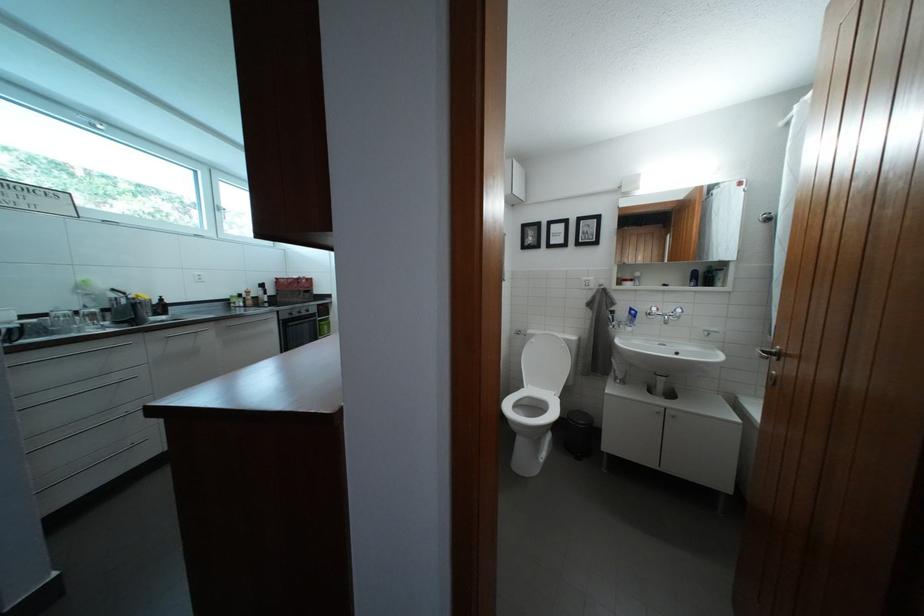
Where would you pull the brown door handle? Please return your answer as a coordinate pair (x, y).

(768, 354)